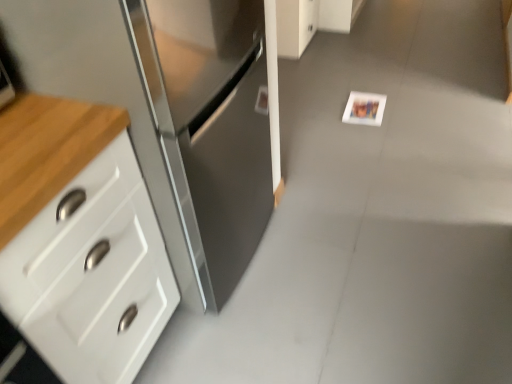
Question: From the image's perspective, is white matte postcard at center located beneath white glossy cabinet at upper center, the second cabinetry when ordered from bottom to top?

Choices:
 (A) yes
 (B) no

Answer: (A)

Question: From the image's perspective, is white matte postcard at center above white glossy cabinet at upper center, the first cabinetry positioned from the back?

Choices:
 (A) yes
 (B) no

Answer: (B)

Question: Is white matte postcard at center oriented away from white glossy cabinet at upper center, which appears as the second cabinetry when viewed from the left?

Choices:
 (A) yes
 (B) no

Answer: (B)

Question: Is white matte postcard at center directly adjacent to white glossy cabinet at upper center, marked as the 1th cabinetry in a top-to-bottom arrangement?

Choices:
 (A) no
 (B) yes

Answer: (A)

Question: Is white matte postcard at center positioned behind white glossy cabinet at upper center, placed as the 1th cabinetry when sorted from right to left?

Choices:
 (A) yes
 (B) no

Answer: (B)

Question: From a real-world perspective, is white matte postcard at center on white glossy cabinet at upper center, marked as the 1th cabinetry in a top-to-bottom arrangement?

Choices:
 (A) no
 (B) yes

Answer: (A)

Question: Is the position of stainless steel cabinet at left, the first cabinetry from the front, more distant than that of white glossy cabinet at upper center, the second cabinetry when ordered from bottom to top?

Choices:
 (A) yes
 (B) no

Answer: (B)

Question: Is white glossy cabinet at upper center, arranged as the second cabinetry when viewed from the front, surrounded by stainless steel cabinet at left, which appears as the 2th cabinetry when viewed from the top?

Choices:
 (A) yes
 (B) no

Answer: (B)

Question: Are stainless steel cabinet at left, positioned as the second cabinetry in right-to-left order, and white glossy cabinet at upper center, placed as the 1th cabinetry when sorted from right to left, far apart?

Choices:
 (A) no
 (B) yes

Answer: (B)

Question: Considering the relative sizes of stainless steel cabinet at left, positioned as the second cabinetry in right-to-left order, and white glossy cabinet at upper center, placed as the 1th cabinetry when sorted from right to left, in the image provided, is stainless steel cabinet at left, positioned as the second cabinetry in right-to-left order, bigger than white glossy cabinet at upper center, placed as the 1th cabinetry when sorted from right to left,?

Choices:
 (A) no
 (B) yes

Answer: (B)

Question: Is stainless steel cabinet at left, positioned as the second cabinetry in right-to-left order, smaller than white glossy cabinet at upper center, arranged as the second cabinetry when viewed from the front?

Choices:
 (A) yes
 (B) no

Answer: (B)

Question: Considering the relative sizes of stainless steel cabinet at left, the second cabinetry viewed from the back, and white glossy cabinet at upper center, the first cabinetry positioned from the back, in the image provided, is stainless steel cabinet at left, the second cabinetry viewed from the back, thinner than white glossy cabinet at upper center, the first cabinetry positioned from the back,?

Choices:
 (A) no
 (B) yes

Answer: (A)

Question: Considering the relative sizes of white glossy cabinet at upper center, marked as the 1th cabinetry in a top-to-bottom arrangement, and white matte postcard at center in the image provided, is white glossy cabinet at upper center, marked as the 1th cabinetry in a top-to-bottom arrangement, shorter than white matte postcard at center?

Choices:
 (A) no
 (B) yes

Answer: (A)